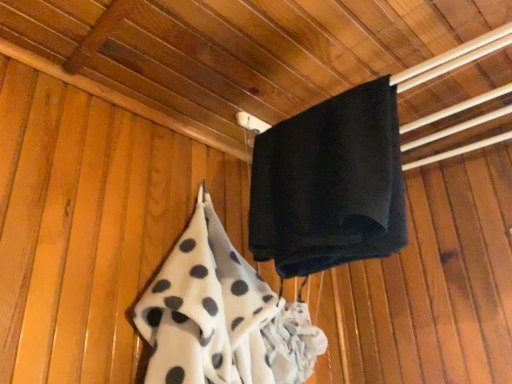
This screenshot has width=512, height=384. I want to click on black matte towel at upper center, so click(329, 184).

What do you see at coordinates (329, 184) in the screenshot? I see `black matte towel at upper center` at bounding box center [329, 184].

Measure the distance between black matte towel at upper center and camera.

black matte towel at upper center is 24.48 inches from camera.

This screenshot has width=512, height=384. In order to click on black matte towel at upper center in this screenshot , I will do `click(329, 184)`.